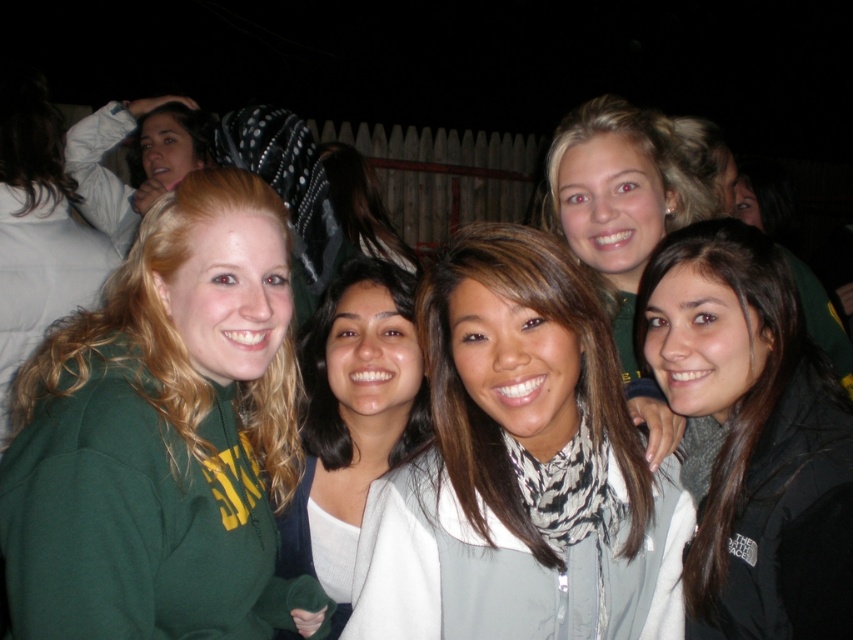
You are trying to decide which scarf to wear tonight based on the image. Both the white textured scarf at center and the white matte scarf at center are options. Which one is shorter in height?

The white textured scarf at center is not as tall as the white matte scarf at center, so the white textured scarf at center is shorter in height.

You are standing in front of the group of women and want to place a small gift between the two points, point (x=648, y=614) and point (x=398, y=275). Which point is closer to you where you should place the gift first?

Point (x=648, y=614) is closer to the viewer than point (x=398, y=275), so you should place the gift near point (x=648, y=614) first.